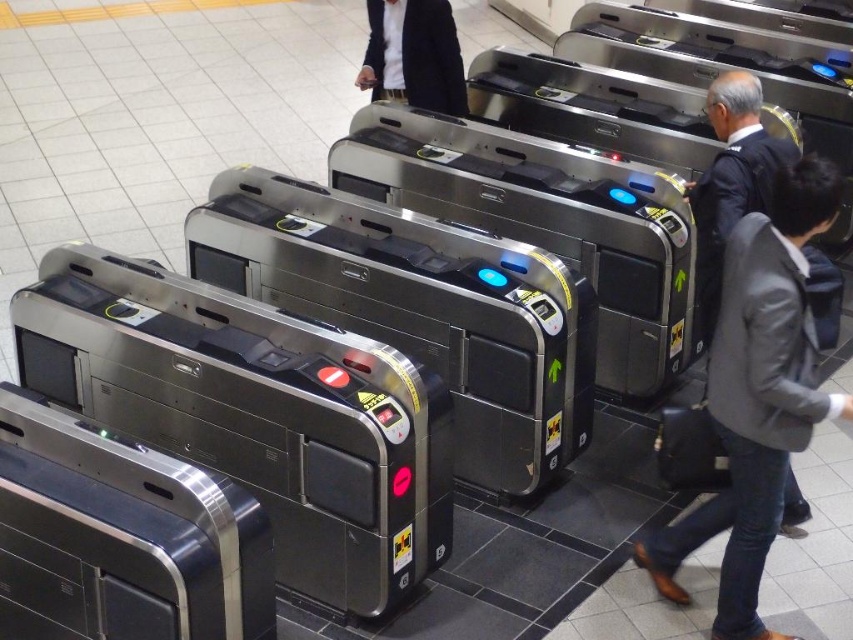
In the scene shown: Can you confirm if dark gray suit at right is taller than leather suitcase at right?

Indeed, dark gray suit at right has a greater height compared to leather suitcase at right.

Between dark gray suit at right and leather suitcase at right, which one appears on the right side from the viewer's perspective?

dark gray suit at right is more to the right.

Who is more forward, [720,212] or [682,445]?

Point [682,445] is more forward.

This screenshot has width=853, height=640. What are the coordinates of `dark gray suit at right` in the screenshot? It's located at (730, 179).

Does gray fabric jacket at right appear on the left side of dark gray wool suit at center?

No, gray fabric jacket at right is not to the left of dark gray wool suit at center.

Can you confirm if gray fabric jacket at right is taller than dark gray wool suit at center?

Correct, gray fabric jacket at right is much taller as dark gray wool suit at center.

Describe the element at coordinates (756, 396) in the screenshot. The image size is (853, 640). I see `gray fabric jacket at right` at that location.

Locate an element on the screen. This screenshot has width=853, height=640. gray fabric jacket at right is located at coordinates (756, 396).

Does gray fabric jacket at right appear on the left side of dark gray suit at right?

Indeed, gray fabric jacket at right is positioned on the left side of dark gray suit at right.

Does gray fabric jacket at right have a greater height compared to dark gray suit at right?

Yes.

Which is in front, point (709, 509) or point (738, 180)?

Point (709, 509)

Where is `gray fabric jacket at right`? gray fabric jacket at right is located at coordinates (756, 396).